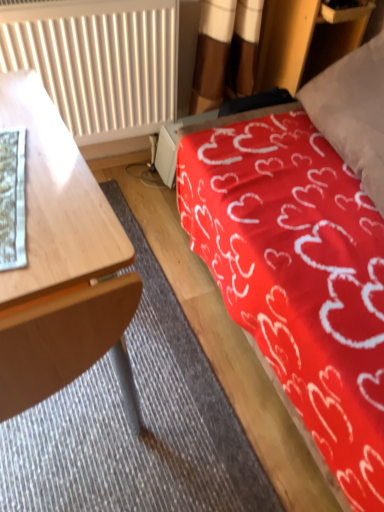
Question: Is white textured radiator at upper left taller or shorter than red fabric bed at upper right?

Choices:
 (A) short
 (B) tall

Answer: (A)

Question: Relative to red fabric bed at upper right, is white textured radiator at upper left in front or behind?

Choices:
 (A) behind
 (B) front

Answer: (A)

Question: Which is nearer to the white paper at left?

Choices:
 (A) wooden desk at left
 (B) red fabric bed at upper right
 (C) white textured radiator at upper left

Answer: (A)

Question: Based on their relative distances, which object is nearer to the white textured radiator at upper left?

Choices:
 (A) red fabric bed at upper right
 (B) wooden desk at left
 (C) white paper at left

Answer: (A)